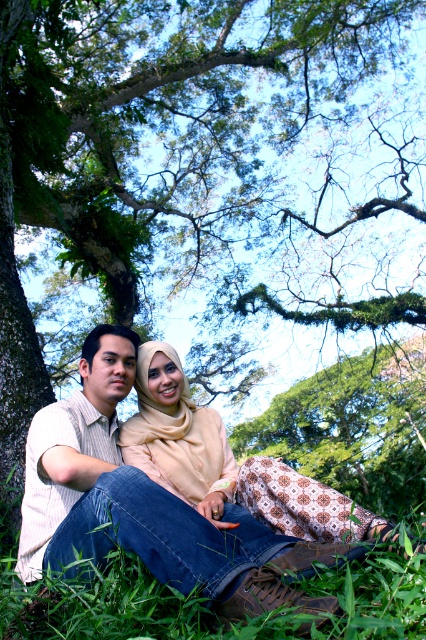
Question: Based on their relative distances, which object is nearer to the beige fabric hijab at center?

Choices:
 (A) striped knit sweater at center
 (B) denim jeans at lower center

Answer: (B)

Question: Does green grass at lower center come in front of beige fabric hijab at center?

Choices:
 (A) no
 (B) yes

Answer: (B)

Question: Considering the real-world distances, which object is closest to the green grass at lower center?

Choices:
 (A) denim jeans at lower center
 (B) striped knit sweater at center

Answer: (A)

Question: Can you confirm if denim jeans at lower center is bigger than striped knit sweater at center?

Choices:
 (A) yes
 (B) no

Answer: (A)

Question: Which point is closer to the camera taking this photo?

Choices:
 (A) [x=80, y=596]
 (B) [x=34, y=444]
 (C) [x=201, y=477]
 (D) [x=103, y=401]

Answer: (A)

Question: Does striped knit sweater at center have a lesser width compared to beige fabric hijab at center?

Choices:
 (A) yes
 (B) no

Answer: (B)